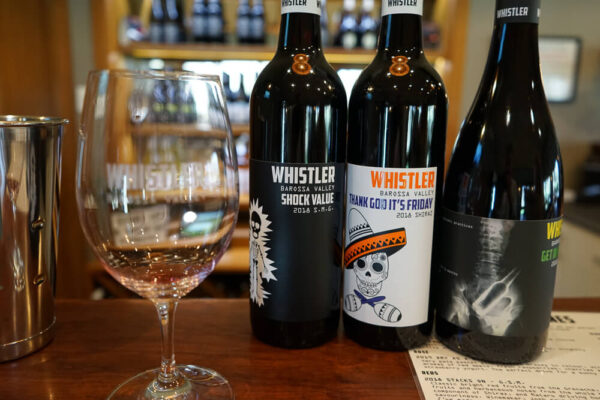
You are a GUI agent. You are given a task and a screenshot of the screen. Output one action in this format:
    pyautogui.click(x=<x>, y=<y>)
    Task: Click on the window
    
    Given the screenshot: What is the action you would take?
    pyautogui.click(x=565, y=82)